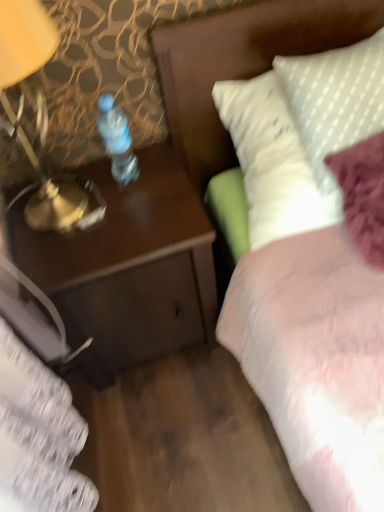
In order to click on empty space that is ontop of brown wood desk at left (from a real-world perspective) in this screenshot , I will do `click(87, 206)`.